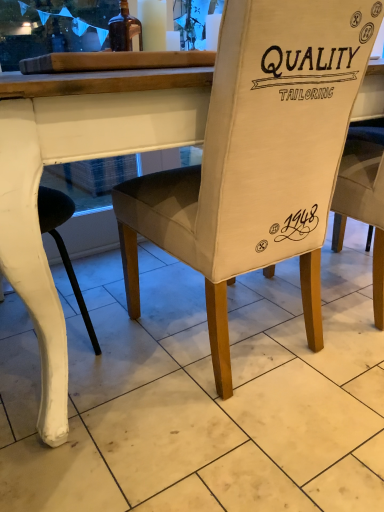
Question: Is point (317, 201) closer or farther from the camera than point (130, 26)?

Choices:
 (A) closer
 (B) farther

Answer: (A)

Question: From a real-world perspective, is beige fabric chair at center physically located above or below brown glass bottle at upper left?

Choices:
 (A) above
 (B) below

Answer: (B)

Question: Is beige fabric chair at center spatially inside brown glass bottle at upper left, or outside of it?

Choices:
 (A) inside
 (B) outside

Answer: (B)

Question: Is brown glass bottle at upper left situated inside beige fabric chair at center or outside?

Choices:
 (A) inside
 (B) outside

Answer: (B)

Question: Does point (117, 31) appear closer or farther from the camera than point (192, 238)?

Choices:
 (A) closer
 (B) farther

Answer: (B)

Question: Looking at the image, does brown glass bottle at upper left seem bigger or smaller compared to beige fabric chair at center?

Choices:
 (A) small
 (B) big

Answer: (A)

Question: Relative to beige fabric chair at center, is brown glass bottle at upper left in front or behind?

Choices:
 (A) front
 (B) behind

Answer: (B)